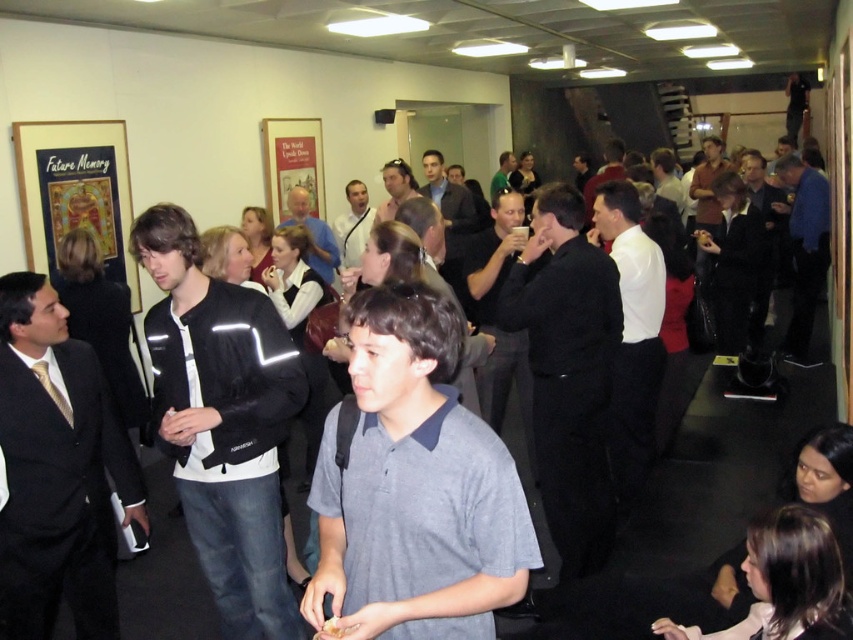
What do you see at coordinates (312, 234) in the screenshot? This screenshot has height=640, width=853. I see `light blue shirt at center` at bounding box center [312, 234].

Which is below, light blue shirt at center or matte black jacket at center?

light blue shirt at center is below.

The image size is (853, 640). Describe the element at coordinates (312, 234) in the screenshot. I see `light blue shirt at center` at that location.

The image size is (853, 640). What are the coordinates of `light blue shirt at center` in the screenshot? It's located at pyautogui.click(x=312, y=234).

Is gray cotton shirt at center further to camera compared to light blue shirt at center?

No, gray cotton shirt at center is in front of light blue shirt at center.

Can you confirm if gray cotton shirt at center is positioned below light blue shirt at center?

Correct, gray cotton shirt at center is located below light blue shirt at center.

Describe the element at coordinates (415, 486) in the screenshot. The width and height of the screenshot is (853, 640). I see `gray cotton shirt at center` at that location.

Where is `gray cotton shirt at center`? The image size is (853, 640). gray cotton shirt at center is located at coordinates (415, 486).

Consider the image. Is gray cotton shirt at center wider than dark gray suit at center?

Yes, gray cotton shirt at center is wider than dark gray suit at center.

Where is `gray cotton shirt at center`? Image resolution: width=853 pixels, height=640 pixels. gray cotton shirt at center is located at coordinates (415, 486).

Image resolution: width=853 pixels, height=640 pixels. What do you see at coordinates (415, 486) in the screenshot?
I see `gray cotton shirt at center` at bounding box center [415, 486].

In order to click on gray cotton shirt at center in this screenshot , I will do `click(415, 486)`.